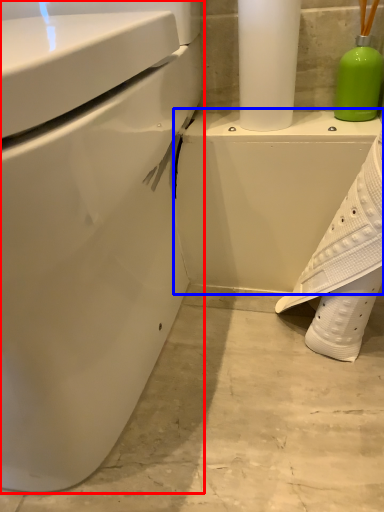
Question: Among these objects, which one is farthest to the camera, toilet (highlighted by a red box) or porcelain (highlighted by a blue box)?

Choices:
 (A) toilet
 (B) porcelain

Answer: (B)